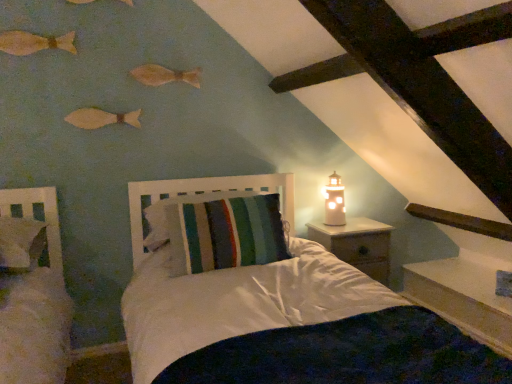
This screenshot has width=512, height=384. Describe the element at coordinates (34, 43) in the screenshot. I see `wooden fish at upper left, marked as the second fish in a top-to-bottom arrangement` at that location.

The width and height of the screenshot is (512, 384). What do you see at coordinates (164, 75) in the screenshot? I see `wooden fish at upper center, placed as the third fish when sorted from top to bottom` at bounding box center [164, 75].

In order to face matte wooden fish at upper left, which ranks as the first fish in bottom-to-top order, should I rotate leftwards or rightwards?

A 19.510 degree turn to the left will do.

Describe the element at coordinates (219, 231) in the screenshot. I see `striped fabric pillow at center` at that location.

The height and width of the screenshot is (384, 512). Identify the location of wooden fish at upper left, marked as the second fish in a top-to-bottom arrangement. pos(34,43).

Is striped fabric pillow at center wider than wooden fish at upper left, marked as the first fish in a top-to-bottom arrangement?

Indeed, striped fabric pillow at center has a greater width compared to wooden fish at upper left, marked as the first fish in a top-to-bottom arrangement.

How distant is striped fabric pillow at center from wooden fish at upper left, marked as the first fish in a top-to-bottom arrangement?

striped fabric pillow at center and wooden fish at upper left, marked as the first fish in a top-to-bottom arrangement, are 4.33 feet apart.

Does striped fabric pillow at center have a larger size compared to wooden fish at upper left, marked as the first fish in a top-to-bottom arrangement?

Correct, striped fabric pillow at center is larger in size than wooden fish at upper left, marked as the first fish in a top-to-bottom arrangement.

Which object is positioned more to the right, striped fabric pillow at center or wooden fish at upper left, marked as the first fish in a top-to-bottom arrangement?

Positioned to the right is striped fabric pillow at center.

Is metallic gold lighthouse at right positioned with its back to striped fabric pillow at center?

metallic gold lighthouse at right does not have its back to striped fabric pillow at center.

Is the position of metallic gold lighthouse at right less distant than that of striped fabric pillow at center?

That is False.

What's the angular difference between metallic gold lighthouse at right and striped fabric pillow at center's facing directions?

The facing directions of metallic gold lighthouse at right and striped fabric pillow at center are 96.6 degrees apart.

Is metallic gold lighthouse at right completely or partially outside of striped fabric pillow at center?

That's correct, metallic gold lighthouse at right is outside of striped fabric pillow at center.

Can wooden fish at upper center, placed as the third fish when sorted from top to bottom, be found inside wooden nightstand at right?

No, wooden fish at upper center, placed as the third fish when sorted from top to bottom, is not inside wooden nightstand at right.

From the image's perspective, is wooden nightstand at right beneath wooden fish at upper center, the 2th fish when ordered from bottom to top?

Indeed, from the image's perspective, wooden nightstand at right is shown beneath wooden fish at upper center, the 2th fish when ordered from bottom to top.

Visually, is wooden nightstand at right positioned to the left or to the right of wooden fish at upper center, placed as the third fish when sorted from top to bottom?

In the image, wooden nightstand at right appears on the right side of wooden fish at upper center, placed as the third fish when sorted from top to bottom.

Between wooden nightstand at right and wooden fish at upper center, placed as the third fish when sorted from top to bottom, which one has larger size?

wooden nightstand at right.

Considering the relative positions of striped fabric pillow at center and wooden fish at upper center, the 2th fish when ordered from bottom to top, in the image provided, is striped fabric pillow at center to the right of wooden fish at upper center, the 2th fish when ordered from bottom to top, from the viewer's perspective?

Yes, striped fabric pillow at center is to the right of wooden fish at upper center, the 2th fish when ordered from bottom to top.

Which of these two, striped fabric pillow at center or wooden fish at upper center, the 2th fish when ordered from bottom to top, stands taller?

striped fabric pillow at center is taller.

Which object is more forward, striped fabric pillow at center or wooden fish at upper center, placed as the third fish when sorted from top to bottom?

striped fabric pillow at center is closer to the camera.

Does striped fabric pillow at center have a greater width compared to wooden fish at upper center, the 2th fish when ordered from bottom to top?

Indeed, striped fabric pillow at center has a greater width compared to wooden fish at upper center, the 2th fish when ordered from bottom to top.

From the image's perspective, which object appears higher, matte wooden fish at upper left, placed as the fourth fish when sorted from top to bottom, or wooden fish at upper left, the 4th fish positioned from the bottom?

wooden fish at upper left, the 4th fish positioned from the bottom, from the image's perspective.

Which of these two, matte wooden fish at upper left, which ranks as the first fish in bottom-to-top order, or wooden fish at upper left, the 4th fish positioned from the bottom, stands taller?

With more height is matte wooden fish at upper left, which ranks as the first fish in bottom-to-top order.

Is matte wooden fish at upper left, which ranks as the first fish in bottom-to-top order, not inside wooden fish at upper left, the 4th fish positioned from the bottom?

Yes.

Is wooden nightstand at right not inside wooden fish at upper left, marked as the second fish in a top-to-bottom arrangement?

That's correct, wooden nightstand at right is outside of wooden fish at upper left, marked as the second fish in a top-to-bottom arrangement.

Is point (320, 230) closer to camera compared to point (42, 47)?

That is False.

Which object is thinner, wooden nightstand at right or wooden fish at upper left, marked as the second fish in a top-to-bottom arrangement?

wooden fish at upper left, marked as the second fish in a top-to-bottom arrangement, is thinner.

Is matte wooden fish at upper left, which ranks as the first fish in bottom-to-top order, a part of wooden fish at upper left, marked as the first fish in a top-to-bottom arrangement?

No, matte wooden fish at upper left, which ranks as the first fish in bottom-to-top order, is not surrounded by wooden fish at upper left, marked as the first fish in a top-to-bottom arrangement.

Is wooden fish at upper left, the 4th fish positioned from the bottom, far away from matte wooden fish at upper left, which ranks as the first fish in bottom-to-top order?

They are positioned close to each other.

Which of these two, wooden fish at upper left, marked as the first fish in a top-to-bottom arrangement, or matte wooden fish at upper left, which ranks as the first fish in bottom-to-top order, is bigger?

Bigger between the two is matte wooden fish at upper left, which ranks as the first fish in bottom-to-top order.

Where is `fish that is the 1st one when counting leftward from the matte wooden fish at upper left, which ranks as the first fish in bottom-to-top order`? This screenshot has width=512, height=384. fish that is the 1st one when counting leftward from the matte wooden fish at upper left, which ranks as the first fish in bottom-to-top order is located at coordinates (80, 1).

There is a striped fabric pillow at center. Where is `the 4th fish above it (from the image's perspective)`? The height and width of the screenshot is (384, 512). the 4th fish above it (from the image's perspective) is located at coordinates (80, 1).

Identify the location of pillow in front of the metallic gold lighthouse at right. (219, 231).

When comparing their distances from metallic gold lighthouse at right, does wooden fish at upper center, placed as the third fish when sorted from top to bottom, or wooden nightstand at right seem further?

wooden fish at upper center, placed as the third fish when sorted from top to bottom, is further to metallic gold lighthouse at right.

When comparing their distances from wooden fish at upper left, which ranks as the 3th fish in bottom-to-top order, does wooden nightstand at right or matte wooden fish at upper left, which ranks as the first fish in bottom-to-top order, seem further?

wooden nightstand at right.

Based on the photo, when comparing their distances from wooden nightstand at right, does wooden fish at upper left, marked as the first fish in a top-to-bottom arrangement, or wooden fish at upper left, which ranks as the 3th fish in bottom-to-top order, seem closer?

Based on the image, wooden fish at upper left, marked as the first fish in a top-to-bottom arrangement, appears to be nearer to wooden nightstand at right.

Estimate the real-world distances between objects in this image. Which object is further from wooden fish at upper center, the 2th fish when ordered from bottom to top, metallic gold lighthouse at right or matte wooden fish at upper left, placed as the fourth fish when sorted from top to bottom?

Based on the image, metallic gold lighthouse at right appears to be further to wooden fish at upper center, the 2th fish when ordered from bottom to top.

Looking at the image, which one is located closer to matte wooden fish at upper left, which ranks as the first fish in bottom-to-top order, wooden nightstand at right or wooden fish at upper center, the 2th fish when ordered from bottom to top?

The object closer to matte wooden fish at upper left, which ranks as the first fish in bottom-to-top order, is wooden fish at upper center, the 2th fish when ordered from bottom to top.

Estimate the real-world distances between objects in this image. Which object is further from wooden nightstand at right, metallic gold lighthouse at right or matte wooden fish at upper left, placed as the fourth fish when sorted from top to bottom?

Among the two, matte wooden fish at upper left, placed as the fourth fish when sorted from top to bottom, is located further to wooden nightstand at right.

Considering their positions, is wooden fish at upper center, the 2th fish when ordered from bottom to top, positioned closer to wooden fish at upper left, marked as the first fish in a top-to-bottom arrangement, than striped fabric pillow at center?

Among the two, wooden fish at upper center, the 2th fish when ordered from bottom to top, is located nearer to wooden fish at upper left, marked as the first fish in a top-to-bottom arrangement.

Estimate the real-world distances between objects in this image. Which object is closer to matte wooden fish at upper left, which ranks as the first fish in bottom-to-top order, wooden fish at upper center, the 2th fish when ordered from bottom to top, or wooden fish at upper left, marked as the first fish in a top-to-bottom arrangement?

wooden fish at upper center, the 2th fish when ordered from bottom to top, lies closer to matte wooden fish at upper left, which ranks as the first fish in bottom-to-top order, than the other object.

Identify the location of pillow located between matte wooden fish at upper left, placed as the fourth fish when sorted from top to bottom, and metallic gold lighthouse at right in the left-right direction. Image resolution: width=512 pixels, height=384 pixels. (219, 231).

This screenshot has height=384, width=512. In order to click on pillow between wooden fish at upper center, placed as the third fish when sorted from top to bottom, and metallic gold lighthouse at right, in the horizontal direction in this screenshot , I will do `click(219, 231)`.

Find the location of `pillow between wooden fish at upper center, the 2th fish when ordered from bottom to top, and wooden nightstand at right`. pillow between wooden fish at upper center, the 2th fish when ordered from bottom to top, and wooden nightstand at right is located at coordinates (219, 231).

Find the location of a particular element. Image resolution: width=512 pixels, height=384 pixels. candle holder between striped fabric pillow at center and wooden nightstand at right is located at coordinates (334, 202).